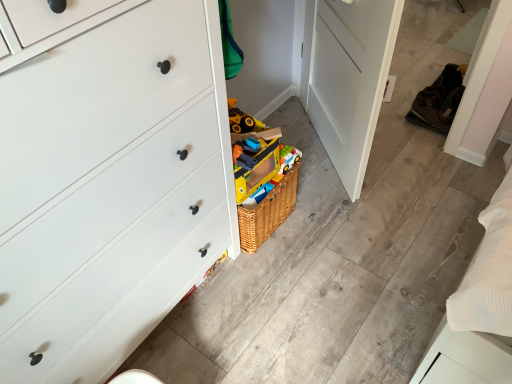
Question: Is white matte chest of drawers at left aimed at brown suede shoe at right, the first shoe in the left-to-right sequence?

Choices:
 (A) no
 (B) yes

Answer: (A)

Question: Does white matte chest of drawers at left have a larger size compared to brown suede shoe at right, the first shoe in the left-to-right sequence?

Choices:
 (A) no
 (B) yes

Answer: (B)

Question: Is white matte chest of drawers at left not within brown suede shoe at right, the first shoe in the left-to-right sequence?

Choices:
 (A) no
 (B) yes

Answer: (B)

Question: Are white matte chest of drawers at left and brown suede shoe at right, the 2th shoe when ordered from right to left, making contact?

Choices:
 (A) yes
 (B) no

Answer: (B)

Question: Is white matte chest of drawers at left not near brown suede shoe at right, the first shoe in the left-to-right sequence?

Choices:
 (A) no
 (B) yes

Answer: (B)

Question: Visually, is brown leather shoe at right, which appears as the first shoe when viewed from the right, positioned to the left or to the right of brown suede shoe at right, the 2th shoe when ordered from right to left?

Choices:
 (A) right
 (B) left

Answer: (A)

Question: Is brown leather shoe at right, which appears as the first shoe when viewed from the right, in front of or behind brown suede shoe at right, the first shoe in the left-to-right sequence, in the image?

Choices:
 (A) behind
 (B) front

Answer: (A)

Question: Is point (449, 102) closer or farther from the camera than point (418, 96)?

Choices:
 (A) farther
 (B) closer

Answer: (B)

Question: From a real-world perspective, is brown leather shoe at right, the 2th shoe in the left-to-right sequence, above or below brown suede shoe at right, the 2th shoe when ordered from right to left?

Choices:
 (A) below
 (B) above

Answer: (B)

Question: In terms of width, does white matte chest of drawers at left look wider or thinner when compared to brown leather shoe at right, the 2th shoe in the left-to-right sequence?

Choices:
 (A) wide
 (B) thin

Answer: (A)

Question: In the image, is white matte chest of drawers at left on the left side or the right side of brown leather shoe at right, the 2th shoe in the left-to-right sequence?

Choices:
 (A) right
 (B) left

Answer: (B)

Question: Is point (142, 228) closer or farther from the camera than point (436, 117)?

Choices:
 (A) closer
 (B) farther

Answer: (A)

Question: From the image's perspective, is white matte chest of drawers at left positioned above or below brown leather shoe at right, the 2th shoe in the left-to-right sequence?

Choices:
 (A) above
 (B) below

Answer: (B)

Question: Looking at their shapes, would you say brown leather shoe at right, the 2th shoe in the left-to-right sequence, is wider or thinner than white matte chest of drawers at left?

Choices:
 (A) wide
 (B) thin

Answer: (B)

Question: From a real-world perspective, is brown leather shoe at right, which appears as the first shoe when viewed from the right, above or below white matte chest of drawers at left?

Choices:
 (A) below
 (B) above

Answer: (A)